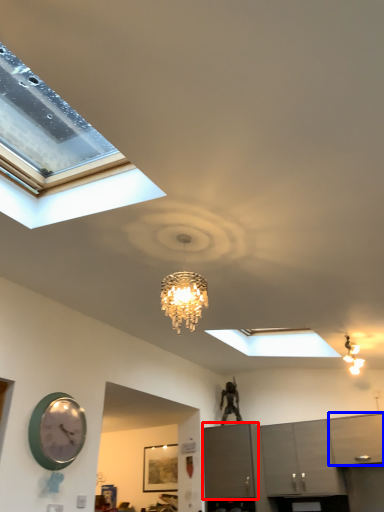
Question: Which of the following is the closest to the observer, cabinetry (highlighted by a red box) or cabinetry (highlighted by a blue box)?

Choices:
 (A) cabinetry
 (B) cabinetry

Answer: (B)